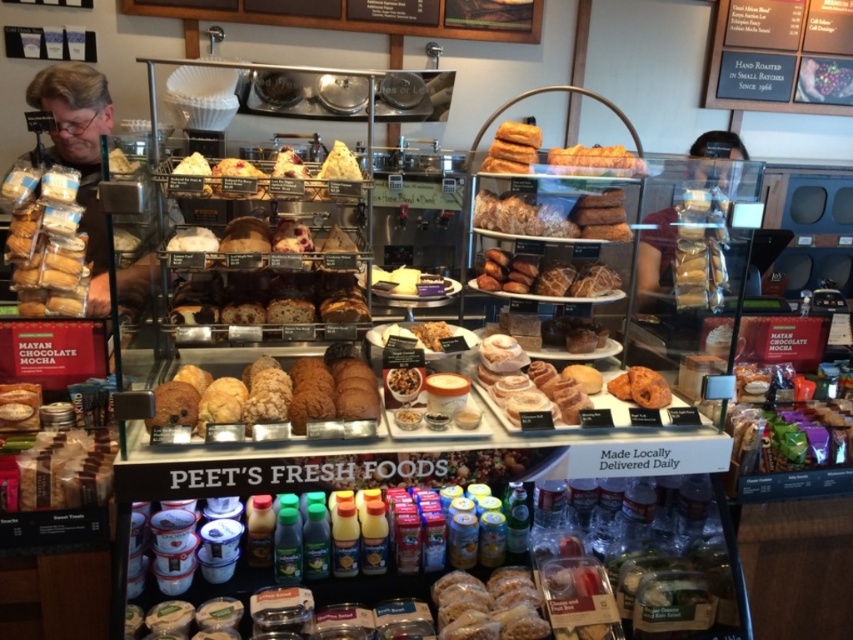
You are a customer at Peet s Fresh Foods and want to buy both the golden brown crumbly pastries at center and the translucent plastic baguette at center. If you have a small basket that can hold items up to 20 inches apart, can you fit both items into the basket without moving them?

The distance between the golden brown crumbly pastries at center and the translucent plastic baguette at center is 22.42 inches, which exceeds the basket s 20 inch capacity. Therefore, you cannot fit both items into the basket without moving them.

You are a customer at Peet Fresh Foods and want to buy both the matte brown bagel at lower left and the translucent plastic baguette at center. When you look at the display case, which item is positioned to the left of the other?

The matte brown bagel at lower left is to the left of the translucent plastic baguette at center.

Consider the image. You are a customer at Peet Fresh Foods and want to know if the matte brown bagel at lower left can fit into the translucent plastic baguette at center without bending it. Can you confirm?

The matte brown bagel at lower left is taller than the translucent plastic baguette at center, so it may not fit without bending the baguette.